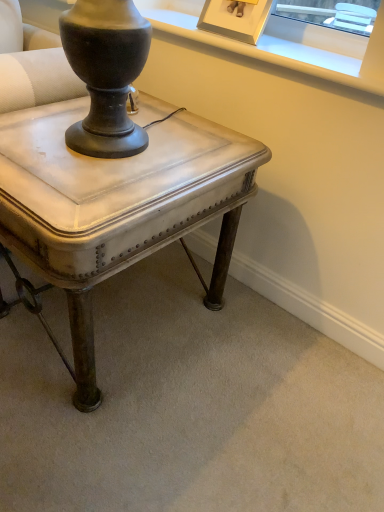
Question: Is gold-framed picture at upper center located outside metallic silver table at center?

Choices:
 (A) no
 (B) yes

Answer: (B)

Question: Is gold-framed picture at upper center closer to camera compared to metallic silver table at center?

Choices:
 (A) yes
 (B) no

Answer: (B)

Question: Is gold-framed picture at upper center shorter than metallic silver table at center?

Choices:
 (A) yes
 (B) no

Answer: (A)

Question: From a real-world perspective, is gold-framed picture at upper center under metallic silver table at center?

Choices:
 (A) no
 (B) yes

Answer: (A)

Question: Is gold-framed picture at upper center touching metallic silver table at center?

Choices:
 (A) yes
 (B) no

Answer: (B)

Question: From the image's perspective, is gold-framed picture at upper center above metallic silver table at center?

Choices:
 (A) yes
 (B) no

Answer: (A)

Question: From a real-world perspective, is metallic silver table at center physically above gold-framed picture at upper center?

Choices:
 (A) yes
 (B) no

Answer: (B)

Question: Can you confirm if metallic silver table at center is taller than gold-framed picture at upper center?

Choices:
 (A) yes
 (B) no

Answer: (A)

Question: Considering the relative sizes of metallic silver table at center and gold-framed picture at upper center in the image provided, is metallic silver table at center thinner than gold-framed picture at upper center?

Choices:
 (A) yes
 (B) no

Answer: (B)

Question: Is metallic silver table at center not close to gold-framed picture at upper center?

Choices:
 (A) yes
 (B) no

Answer: (B)

Question: Does metallic silver table at center have a lesser height compared to gold-framed picture at upper center?

Choices:
 (A) yes
 (B) no

Answer: (B)

Question: Is the position of metallic silver table at center more distant than that of gold-framed picture at upper center?

Choices:
 (A) yes
 (B) no

Answer: (B)

Question: Looking at the image, does metallic silver table at center seem bigger or smaller compared to gold-framed picture at upper center?

Choices:
 (A) big
 (B) small

Answer: (A)